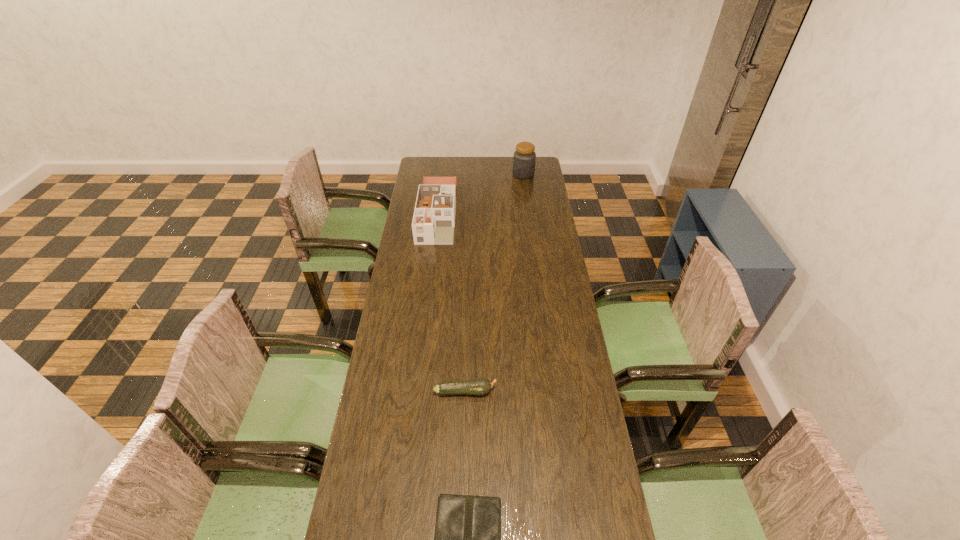
Find the location of a particular element. This screenshot has height=540, width=960. object at the far edge is located at coordinates (524, 158).

What are the coordinates of `object that is at the left edge` in the screenshot? It's located at (433, 222).

Identify the location of object at the right edge. (524, 158).

Where is `object that is at the far right corner`? The width and height of the screenshot is (960, 540). object that is at the far right corner is located at coordinates (524, 158).

In the image, there is a desktop. Identify the location of free space at the left edge. (400, 309).

At what (x,y) coordinates should I click in order to perform the action: click on free space at the right edge of the desktop. Please return your answer as a coordinate pair (x, y). Looking at the image, I should click on (538, 275).

Image resolution: width=960 pixels, height=540 pixels. In order to click on free space at the far left corner of the desktop in this screenshot , I will do `click(429, 173)`.

You are a GUI agent. You are given a task and a screenshot of the screen. Output one action in this format:
    pyautogui.click(x=<x>, y=<y>)
    Task: Click on the blank space at the far right corner of the desktop
    
    Given the screenshot: What is the action you would take?
    pyautogui.click(x=545, y=172)

Image resolution: width=960 pixels, height=540 pixels. I want to click on free space between the second farthest object and the farthest object, so click(480, 193).

The height and width of the screenshot is (540, 960). In order to click on vacant point located between the second farthest object and the rightmost object in this screenshot , I will do `click(480, 193)`.